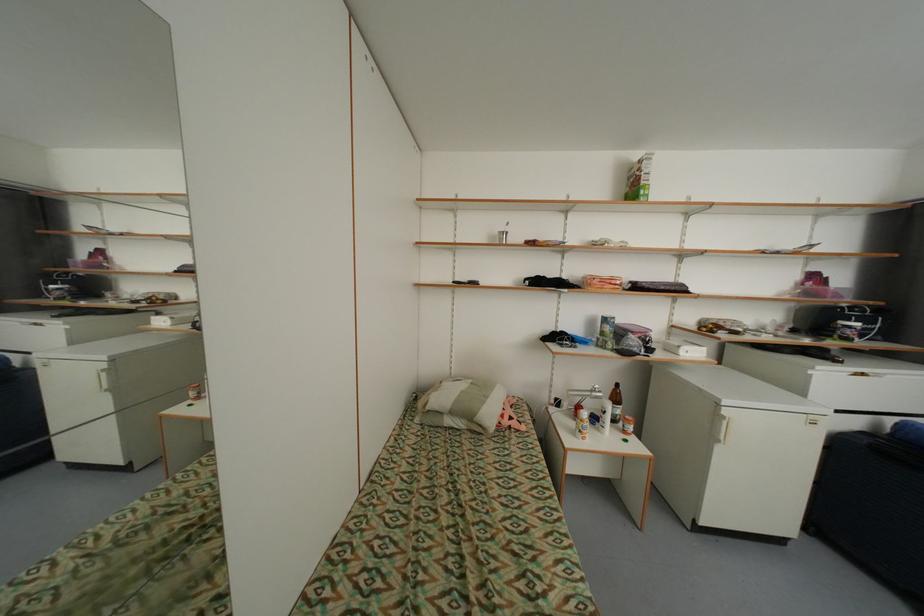
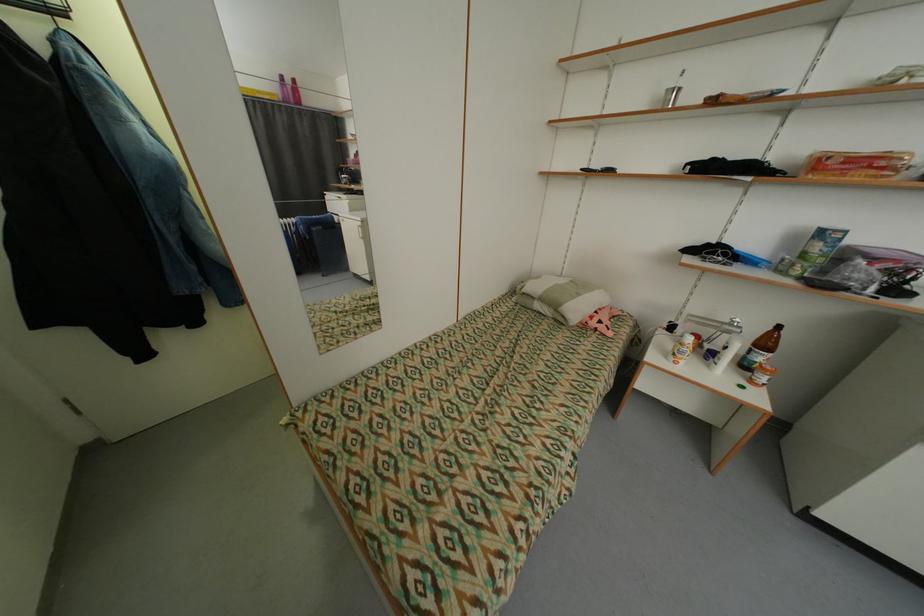
Locate, in the second image, the point that corresponds to point (622, 400) in the first image.

(772, 345)